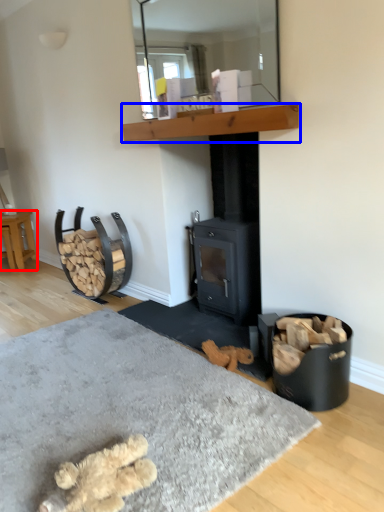
Question: Which point is further to the camera, furniture (highlighted by a red box) or shelf (highlighted by a blue box)?

Choices:
 (A) furniture
 (B) shelf

Answer: (A)